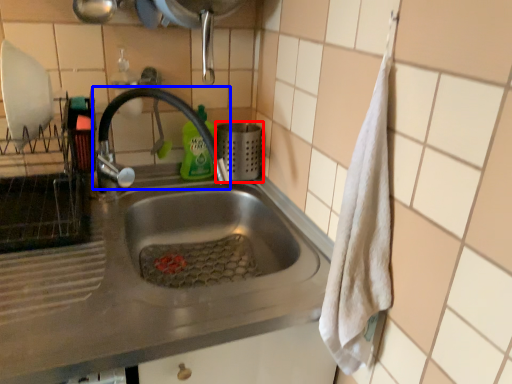
Question: Which point is closer to the camera, appliance (highlighted by a red box) or tap (highlighted by a blue box)?

Choices:
 (A) appliance
 (B) tap

Answer: (B)